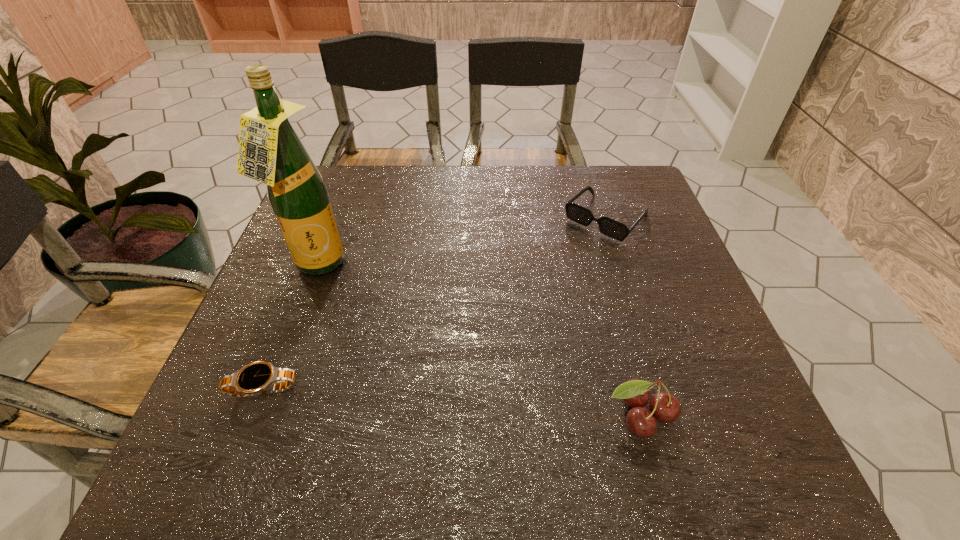
The width and height of the screenshot is (960, 540). Identify the location of blank space located 0.310m on the front-facing side of the sunglasses. (514, 313).

Locate an element on the screen. Image resolution: width=960 pixels, height=540 pixels. object located at the far edge is located at coordinates (607, 226).

The height and width of the screenshot is (540, 960). I want to click on watch at the near edge, so click(260, 377).

This screenshot has width=960, height=540. I want to click on cherry positioned at the near edge, so click(665, 407).

You are a GUI agent. You are given a task and a screenshot of the screen. Output one action in this format:
    pyautogui.click(x=<x>, y=<y>)
    Task: Click on the watch situated at the left edge
    
    Given the screenshot: What is the action you would take?
    pyautogui.click(x=260, y=377)

Identify the location of liquor that is at the left edge. The width and height of the screenshot is (960, 540). (270, 151).

Where is `cherry located in the right edge section of the desktop`? This screenshot has height=540, width=960. cherry located in the right edge section of the desktop is located at coordinates (665, 407).

Find the location of `sunglasses that is at the right edge`. sunglasses that is at the right edge is located at coordinates (607, 226).

The width and height of the screenshot is (960, 540). In order to click on object that is positioned at the near left corner in this screenshot , I will do `click(260, 377)`.

In order to click on object that is at the far right corner in this screenshot , I will do `click(607, 226)`.